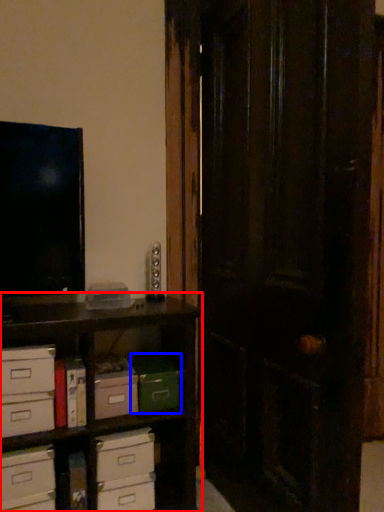
Question: Which object appears farthest to the camera in this image, shelf (highlighted by a red box) or storage box (highlighted by a blue box)?

Choices:
 (A) shelf
 (B) storage box

Answer: (B)